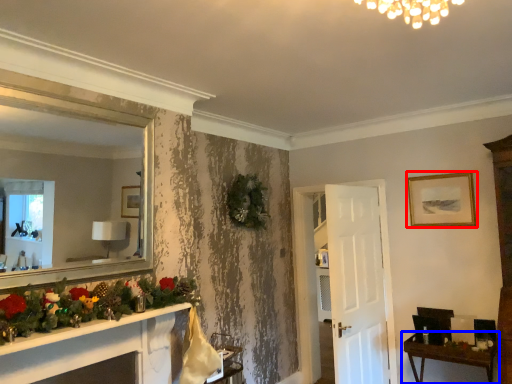
Question: Which object is closer to the camera taking this photo, picture frame (highlighted by a red box) or table (highlighted by a blue box)?

Choices:
 (A) picture frame
 (B) table

Answer: (B)